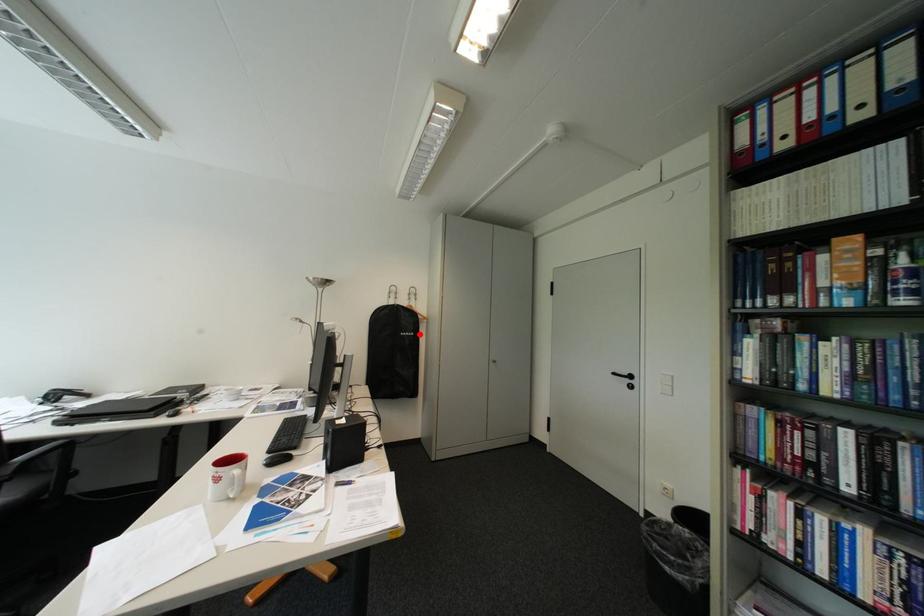
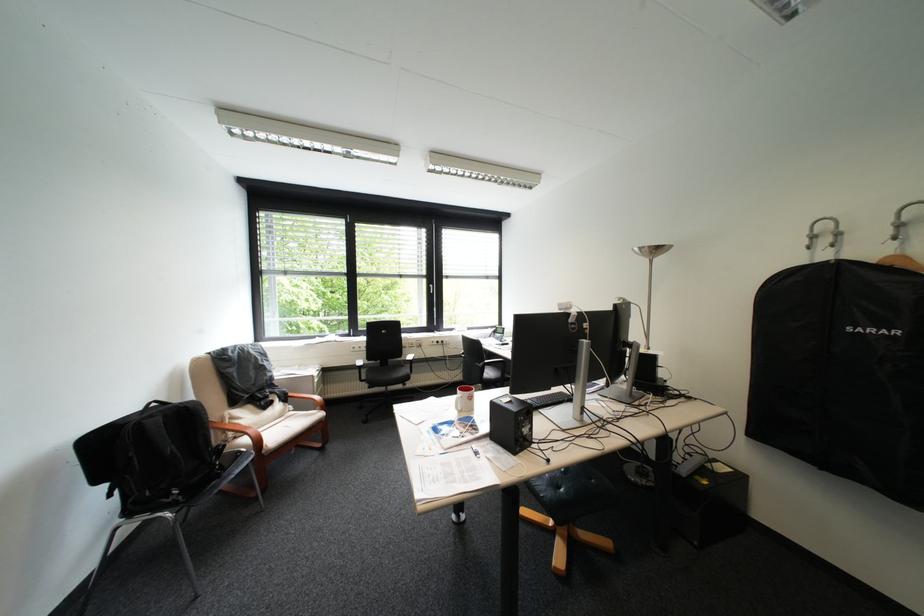
In the second image, find the point that corresponds to the highlighted location in the first image.

(883, 331)